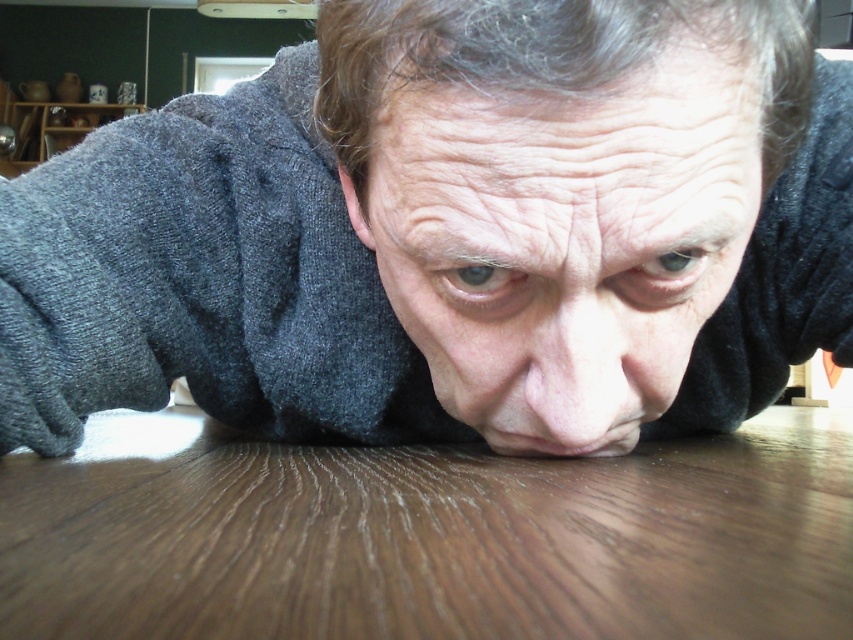
Question: Which object is farther from the camera taking this photo?

Choices:
 (A) dark gray sweater at center
 (B) brown wood table at center
 (C) smooth skin face at center

Answer: (C)

Question: Is brown wood table at center thinner than smooth skin face at center?

Choices:
 (A) no
 (B) yes

Answer: (A)

Question: Is brown wood table at center to the left of smooth skin face at center from the viewer's perspective?

Choices:
 (A) yes
 (B) no

Answer: (A)

Question: Is dark gray sweater at center positioned before smooth skin face at center?

Choices:
 (A) no
 (B) yes

Answer: (B)

Question: Among these points, which one is farthest from the camera?

Choices:
 (A) (766, 177)
 (B) (77, 502)
 (C) (466, 381)

Answer: (C)

Question: Which of the following is the farthest from the observer?

Choices:
 (A) (708, 560)
 (B) (572, 106)
 (C) (833, 342)

Answer: (C)